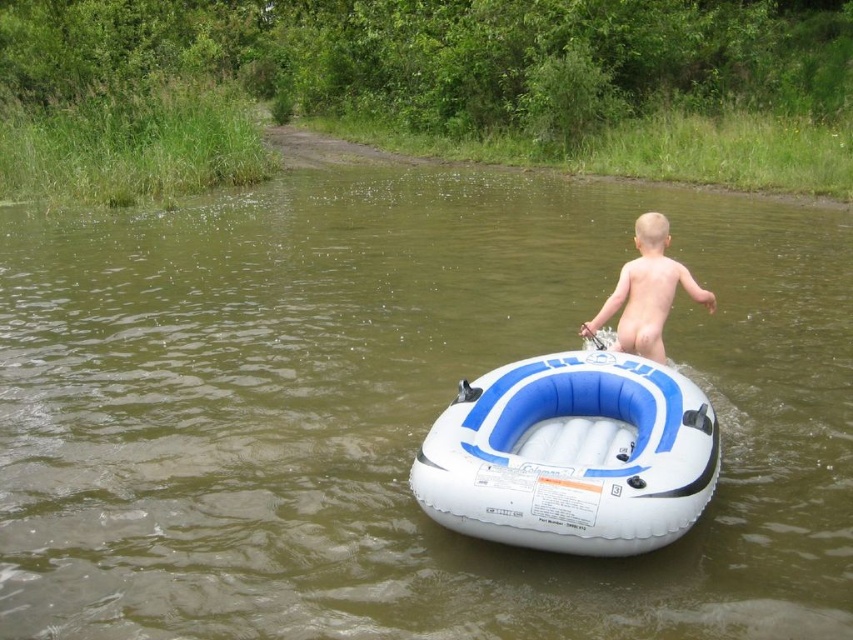
Is white inflatable boat at center positioned in front of naked skin boy at center?

Yes, white inflatable boat at center is in front of naked skin boy at center.

Is white inflatable boat at center behind naked skin boy at center?

No, white inflatable boat at center is closer to the viewer.

Does point (543, 540) come in front of point (631, 337)?

Yes, point (543, 540) is in front of point (631, 337).

Where is `white inflatable boat at center`? The width and height of the screenshot is (853, 640). white inflatable boat at center is located at coordinates (572, 456).